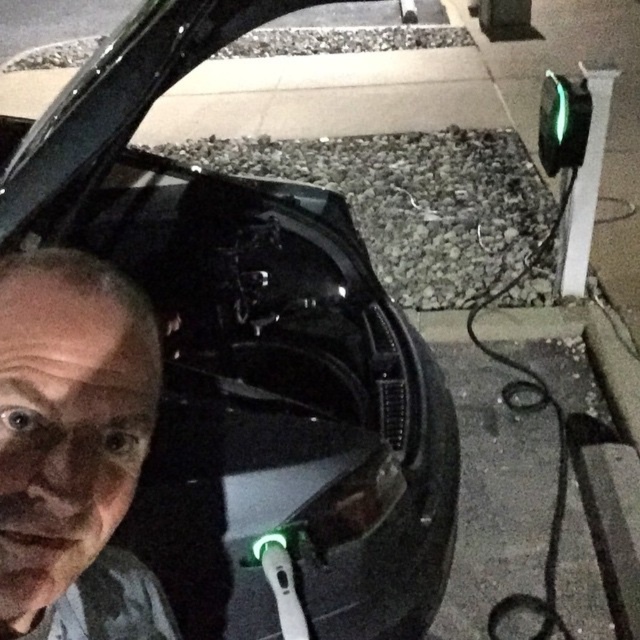
Question: Does black glossy car at center appear on the left side of gray matte face at center?

Choices:
 (A) yes
 (B) no

Answer: (B)

Question: Can you confirm if black glossy car at center is smaller than gray matte face at center?

Choices:
 (A) yes
 (B) no

Answer: (B)

Question: Which point is farther to the camera?

Choices:
 (A) gray matte face at center
 (B) black glossy car at center

Answer: (B)

Question: Among these points, which one is nearest to the camera?

Choices:
 (A) (236, 440)
 (B) (140, 372)

Answer: (B)

Question: Does black glossy car at center appear on the right side of gray matte face at center?

Choices:
 (A) yes
 (B) no

Answer: (A)

Question: Which point appears closest to the camera in this image?

Choices:
 (A) (48, 397)
 (B) (42, 140)

Answer: (A)